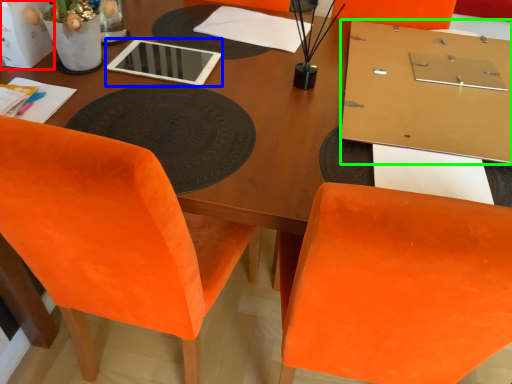
Question: Which object is positioned farthest from box (highlighted by a red box)? Select from tablet computer (highlighted by a blue box) and table (highlighted by a green box).

Choices:
 (A) tablet computer
 (B) table

Answer: (B)